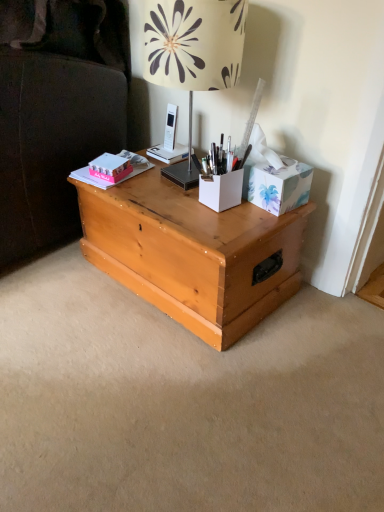
Locate an element on the screen. The height and width of the screenshot is (512, 384). empty space that is in between pink matte box at upper left and white matte pen holder at center, marked as the 2th cardboard box in a right-to-left arrangement is located at coordinates (163, 187).